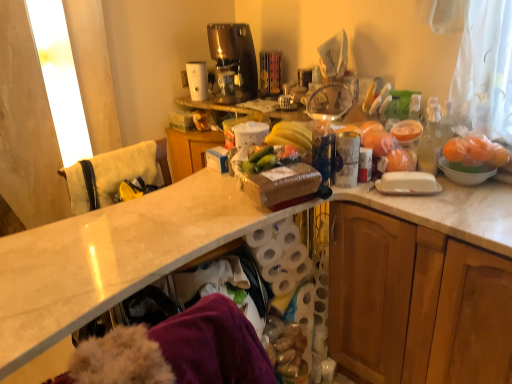
I want to click on free space above wooden cabinet at right (from a real-world perspective), so click(x=450, y=198).